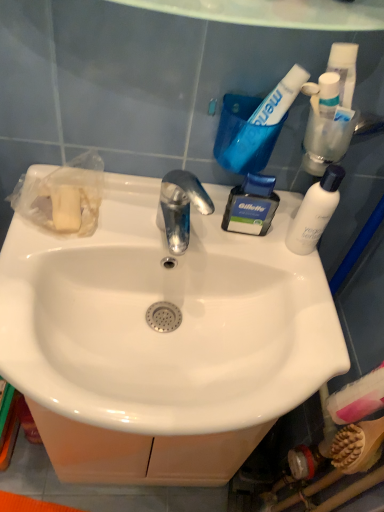
Question: Is point (372, 455) closer or farther from the camera than point (249, 130)?

Choices:
 (A) closer
 (B) farther

Answer: (B)

Question: Looking at the image, does wooden bristles brush at lower right seem bigger or smaller compared to white glossy toothpaste at upper right?

Choices:
 (A) big
 (B) small

Answer: (B)

Question: Estimate the real-world distances between objects in this image. Which object is farther from the white matte bottle at upper right?

Choices:
 (A) clear plastic tube at upper right, marked as the 2th toiletry in a right-to-left arrangement
 (B) blue plastic shaving cream at upper right, arranged as the 2th toiletry when ordered from the bottom
 (C) white glossy sink at center
 (D) pink matte toothbrush at lower right, the first toiletry viewed from the right
 (E) white glossy toothpaste at upper right

Answer: (D)

Question: Which of these objects is positioned closest to the white glossy sink at center?

Choices:
 (A) wooden bristles brush at lower right
 (B) white matte bottle at upper right
 (C) pink matte toothbrush at lower right, marked as the first toiletry in a bottom-to-top arrangement
 (D) blue plastic shaving cream at upper right, which is the third toiletry from right to left
 (E) clear plastic tube at upper right, the second toiletry in the left-to-right sequence

Answer: (D)